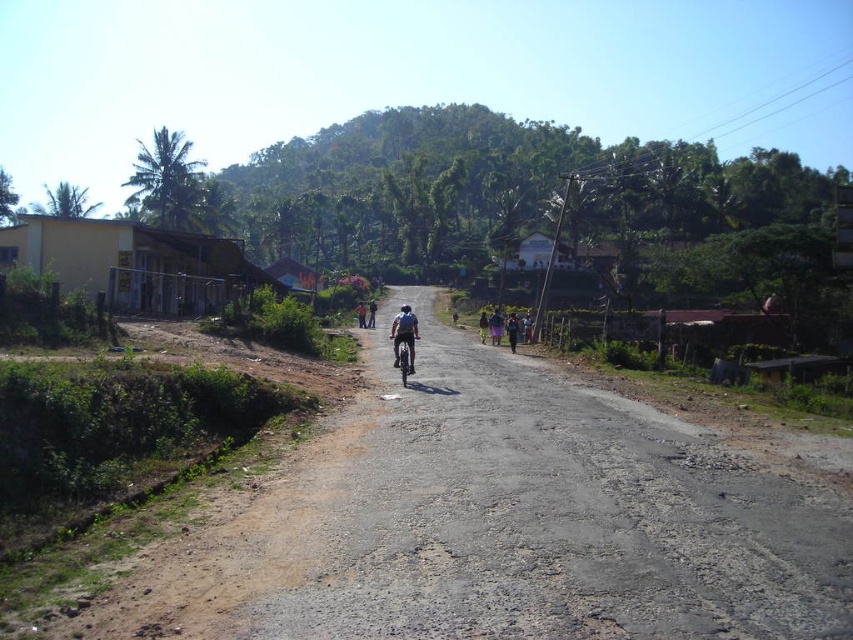
You are standing at the point marked by the coordinates point [496,524]. What is the nearest object to you?

The nearest object to you is the brown dirt track at center represented by point [496,524].